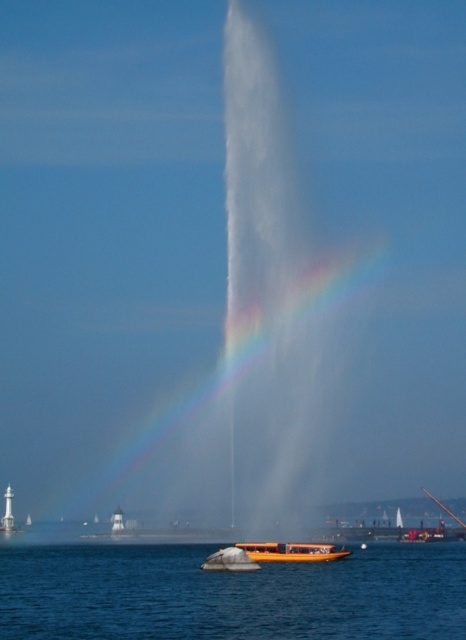
Who is lower down, rainbow translucent at center or blue water at lower center?

Positioned lower is blue water at lower center.

Is rainbow translucent at center smaller than blue water at lower center?

No, rainbow translucent at center is not smaller than blue water at lower center.

Find the location of a particular element. Image resolution: width=466 pixels, height=640 pixels. rainbow translucent at center is located at coordinates (267, 385).

Which is above, rainbow translucent at center or orange polished wood boat at center?

Positioned higher is rainbow translucent at center.

Is rainbow translucent at center shorter than orange polished wood boat at center?

In fact, rainbow translucent at center may be taller than orange polished wood boat at center.

Where is `rainbow translucent at center`? rainbow translucent at center is located at coordinates (267, 385).

Who is positioned more to the left, blue water at lower center or orange polished wood boat at center?

Positioned to the left is blue water at lower center.

Is point (182, 630) less distant than point (266, 556)?

Yes, point (182, 630) is in front of point (266, 556).

This screenshot has width=466, height=640. I want to click on blue water at lower center, so click(x=228, y=593).